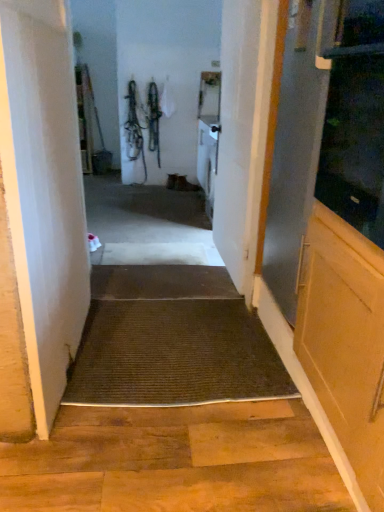
Question: Is transparent glass screen door at right, placed as the second screen door when sorted from front to back, positioned in front of white wood door at center, acting as the second door starting from the left?

Choices:
 (A) no
 (B) yes

Answer: (B)

Question: Is the surface of transparent glass screen door at right, arranged as the first screen door when viewed from the back, in direct contact with white wood door at center, acting as the second door starting from the left?

Choices:
 (A) no
 (B) yes

Answer: (A)

Question: Considering the relative sizes of transparent glass screen door at right, arranged as the first screen door when viewed from the back, and white wood door at center, which ranks as the 1th door in right-to-left order, in the image provided, is transparent glass screen door at right, arranged as the first screen door when viewed from the back, bigger than white wood door at center, which ranks as the 1th door in right-to-left order,?

Choices:
 (A) no
 (B) yes

Answer: (B)

Question: Does transparent glass screen door at right, arranged as the first screen door when viewed from the back, turn towards white wood door at center, which ranks as the 1th door in right-to-left order?

Choices:
 (A) no
 (B) yes

Answer: (A)

Question: From a real-world perspective, does transparent glass screen door at right, arranged as the first screen door when viewed from the back, sit lower than white wood door at center, which ranks as the 1th door in right-to-left order?

Choices:
 (A) no
 (B) yes

Answer: (A)

Question: From the image's perspective, relative to brown textured mat at center, the first doormat when ordered from back to front, is transparent glass screen door at right, the first screen door when ordered from front to back, above or below?

Choices:
 (A) above
 (B) below

Answer: (A)

Question: In terms of height, does transparent glass screen door at right, the first screen door when ordered from front to back, look taller or shorter compared to brown textured mat at center, the 2th doormat positioned from the bottom?

Choices:
 (A) short
 (B) tall

Answer: (B)

Question: Relative to brown textured mat at center, the 2th doormat positioned from the bottom, is transparent glass screen door at right, which is the second screen door from back to front, in front or behind?

Choices:
 (A) behind
 (B) front

Answer: (B)

Question: In terms of width, does transparent glass screen door at right, which is the second screen door from back to front, look wider or thinner when compared to brown textured mat at center, the 2th doormat positioned from the bottom?

Choices:
 (A) wide
 (B) thin

Answer: (B)

Question: In terms of size, does brown textured mat at center, which is the second doormat in back-to-front order, appear bigger or smaller than brown textured mat at center, the 1th doormat in the top-to-bottom sequence?

Choices:
 (A) small
 (B) big

Answer: (B)

Question: Considering the positions of brown textured mat at center, which is the second doormat in back-to-front order, and brown textured mat at center, placed as the 2th doormat when sorted from front to back, in the image, is brown textured mat at center, which is the second doormat in back-to-front order, wider or thinner than brown textured mat at center, placed as the 2th doormat when sorted from front to back,?

Choices:
 (A) wide
 (B) thin

Answer: (A)

Question: In the image, is brown textured mat at center, the second doormat when ordered from top to bottom, positioned in front of or behind brown textured mat at center, the 1th doormat in the top-to-bottom sequence?

Choices:
 (A) front
 (B) behind

Answer: (A)

Question: From their relative heights in the image, would you say brown textured mat at center, which is the second doormat in back-to-front order, is taller or shorter than brown textured mat at center, the 2th doormat positioned from the bottom?

Choices:
 (A) short
 (B) tall

Answer: (B)

Question: In terms of width, does white wood door at center, which ranks as the 1th door in right-to-left order, look wider or thinner when compared to brown textured mat at center, which is the second doormat in back-to-front order?

Choices:
 (A) wide
 (B) thin

Answer: (B)

Question: Considering the positions of point (226, 76) and point (139, 368), is point (226, 76) closer or farther from the camera than point (139, 368)?

Choices:
 (A) closer
 (B) farther

Answer: (B)